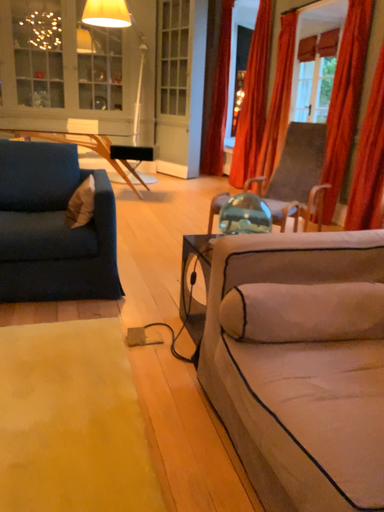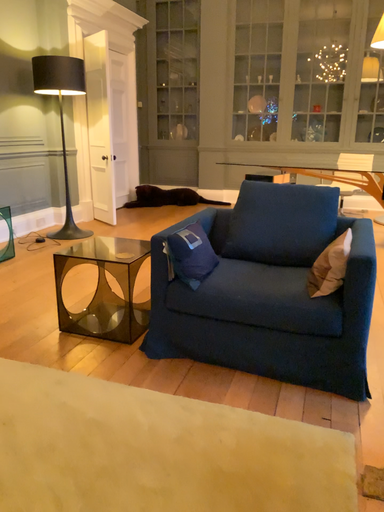
Question: How did the camera likely rotate when shooting the video?

Choices:
 (A) rotated downward
 (B) rotated upward

Answer: (B)